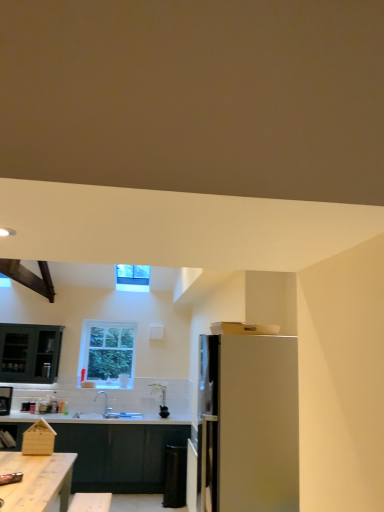
Question: Is wooden table at lower left behind metallic silver toaster at lower left?

Choices:
 (A) yes
 (B) no

Answer: (B)

Question: Is wooden table at lower left aimed at metallic silver toaster at lower left?

Choices:
 (A) yes
 (B) no

Answer: (A)

Question: From the image's perspective, is wooden table at lower left below metallic silver toaster at lower left?

Choices:
 (A) no
 (B) yes

Answer: (B)

Question: Is wooden table at lower left bigger than metallic silver toaster at lower left?

Choices:
 (A) no
 (B) yes

Answer: (B)

Question: Can you confirm if wooden table at lower left is thinner than metallic silver toaster at lower left?

Choices:
 (A) yes
 (B) no

Answer: (B)

Question: Would you say white glossy sink at center is to the left or to the right of wooden table at lower left in the picture?

Choices:
 (A) left
 (B) right

Answer: (B)

Question: Looking at the image, does white glossy sink at center seem bigger or smaller compared to wooden table at lower left?

Choices:
 (A) small
 (B) big

Answer: (A)

Question: Considering the positions of point (102, 415) and point (33, 480), is point (102, 415) closer or farther from the camera than point (33, 480)?

Choices:
 (A) closer
 (B) farther

Answer: (B)

Question: Which is correct: white glossy sink at center is inside wooden table at lower left, or outside of it?

Choices:
 (A) outside
 (B) inside

Answer: (A)

Question: Considering the positions of wooden table at lower left and dark gray matte cabinetry at lower center in the image, is wooden table at lower left taller or shorter than dark gray matte cabinetry at lower center?

Choices:
 (A) short
 (B) tall

Answer: (A)

Question: Is wooden table at lower left in front of or behind dark gray matte cabinetry at lower center in the image?

Choices:
 (A) front
 (B) behind

Answer: (A)

Question: In terms of size, does wooden table at lower left appear bigger or smaller than dark gray matte cabinetry at lower center?

Choices:
 (A) small
 (B) big

Answer: (A)

Question: Is wooden table at lower left wider or thinner than dark gray matte cabinetry at lower center?

Choices:
 (A) wide
 (B) thin

Answer: (A)

Question: From a real-world perspective, is dark gray matte cabinetry at lower center positioned above or below metallic silver toaster at lower left?

Choices:
 (A) below
 (B) above

Answer: (A)

Question: From their relative heights in the image, would you say dark gray matte cabinetry at lower center is taller or shorter than metallic silver toaster at lower left?

Choices:
 (A) tall
 (B) short

Answer: (A)